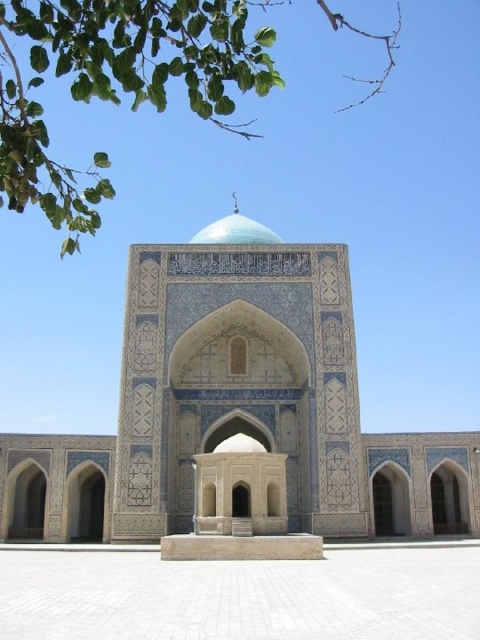
Question: Which object appears closest to the camera in this image?

Choices:
 (A) green leafy tree at upper left
 (B) teal glazed dome at center

Answer: (A)

Question: Among these points, which one is farthest from the camera?

Choices:
 (A) (260, 236)
 (B) (88, 196)

Answer: (A)

Question: Observing the image, what is the correct spatial positioning of green leafy tree at upper left in reference to teal glazed dome at center?

Choices:
 (A) right
 (B) left

Answer: (B)

Question: Is green leafy tree at upper left positioned in front of teal glazed dome at center?

Choices:
 (A) yes
 (B) no

Answer: (A)

Question: Can you confirm if green leafy tree at upper left is positioned to the right of teal glazed dome at center?

Choices:
 (A) no
 (B) yes

Answer: (A)